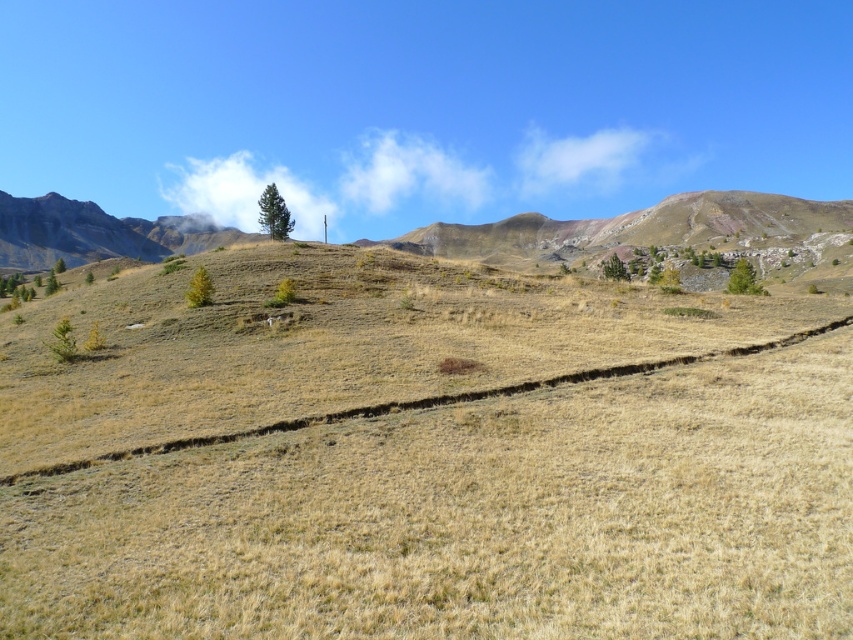
Question: Does rugged stone mountain at upper left have a greater width compared to green matte tree at lower left?

Choices:
 (A) yes
 (B) no

Answer: (A)

Question: Is rustic brown mountain at center below green matte tree at center?

Choices:
 (A) no
 (B) yes

Answer: (A)

Question: Can you confirm if rustic brown mountain at center is positioned below green matte tree at lower left?

Choices:
 (A) no
 (B) yes

Answer: (A)

Question: Considering the real-world distances, which object is closest to the green matte tree at center-right?

Choices:
 (A) green matte tree at lower left
 (B) rugged stone mountain at upper left

Answer: (A)

Question: Which is nearer to the rustic brown mountain at center?

Choices:
 (A) green matte tree at center-right
 (B) green textured tree at right
 (C) rugged stone mountain at upper left
 (D) green matte tree at center

Answer: (A)

Question: Which of the following is the closest to the observer?

Choices:
 (A) (283, 237)
 (B) (607, 272)
 (C) (643, 227)
 (D) (195, 276)

Answer: (D)